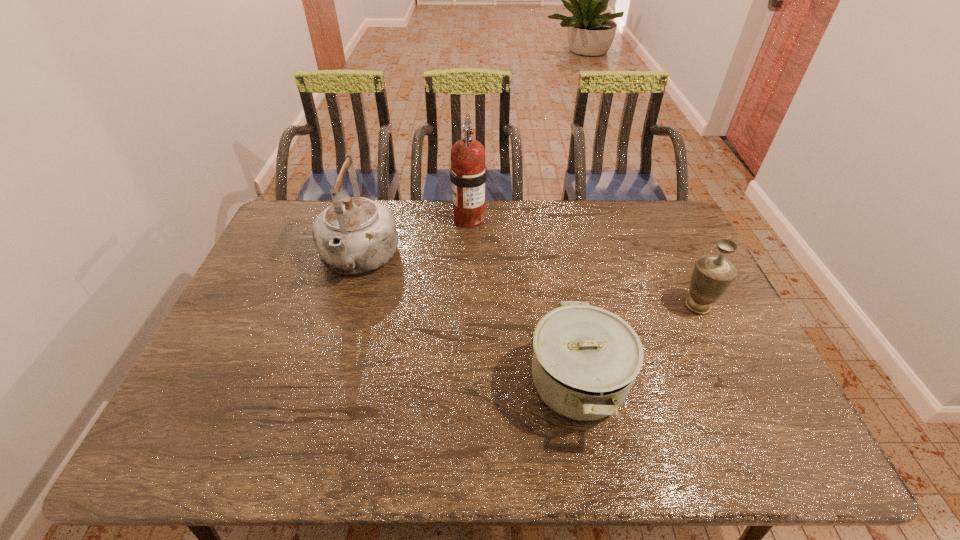
Identify the location of free space that satisfies the following two spatial constraints: 1. at the nozzle of the fire extinguisher; 2. on the left side of the third tallest object. (467, 306).

The width and height of the screenshot is (960, 540). In order to click on vacant region that satisfies the following two spatial constraints: 1. at the spout of the shortest object; 2. on the left side of the second tallest object in this screenshot , I will do `click(323, 383)`.

Where is `free location that satisfies the following two spatial constraints: 1. at the spout of the rightmost object; 2. on the left side of the third shortest object`? free location that satisfies the following two spatial constraints: 1. at the spout of the rightmost object; 2. on the left side of the third shortest object is located at coordinates (346, 306).

Locate an element on the screen. The width and height of the screenshot is (960, 540). vacant region that satisfies the following two spatial constraints: 1. at the nozzle of the third tallest object; 2. on the right side of the fire extinguisher is located at coordinates tap(467, 306).

Find the location of a particular element. free spot that satisfies the following two spatial constraints: 1. at the nozzle of the rightmost object; 2. on the right side of the fire extinguisher is located at coordinates (467, 306).

Where is `free location that satisfies the following two spatial constraints: 1. at the nozzle of the second object from left to right; 2. on the right side of the rightmost object`? This screenshot has height=540, width=960. free location that satisfies the following two spatial constraints: 1. at the nozzle of the second object from left to right; 2. on the right side of the rightmost object is located at coordinates (467, 306).